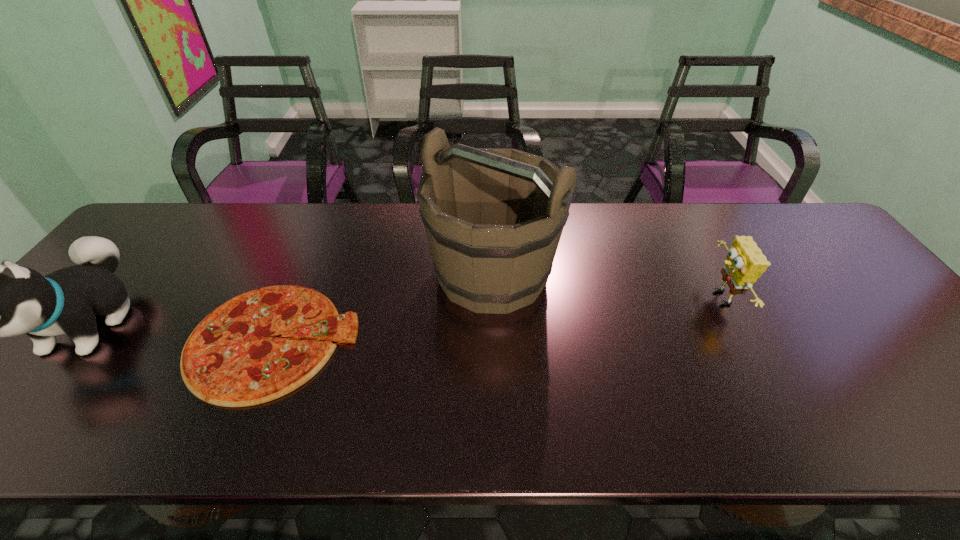
Identify the location of free spot between the third object from right to left and the third object from left to right. (383, 307).

Locate an element on the screen. The height and width of the screenshot is (540, 960). free spot between the bucket and the rightmost object is located at coordinates pos(606,286).

You are a GUI agent. You are given a task and a screenshot of the screen. Output one action in this format:
    pyautogui.click(x=<x>, y=<y>)
    Task: Click on the free space between the bucket and the third object from right to left
    This screenshot has height=540, width=960.
    Given the screenshot: What is the action you would take?
    pyautogui.click(x=383, y=307)

What are the coordinates of `vacant space that's between the bucket and the rightmost object` in the screenshot? It's located at (606, 286).

You are a GUI agent. You are given a task and a screenshot of the screen. Output one action in this format:
    pyautogui.click(x=<x>, y=<y>)
    Task: Click on the free point between the sponge and the tallest object
    
    Given the screenshot: What is the action you would take?
    coord(606,286)

In order to click on unoccupied position between the shortest object and the sponge in this screenshot , I will do [x=496, y=319].

Select which object appears as the closest to the tallest object. Please provide its 2D coordinates. Your answer should be formatted as a tuple, i.e. [(x, y)], where the tuple contains the x and y coordinates of a point satisfying the conditions above.

[(230, 359)]

Locate an element on the screen. This screenshot has width=960, height=540. object that is the closest to the sponge is located at coordinates (494, 217).